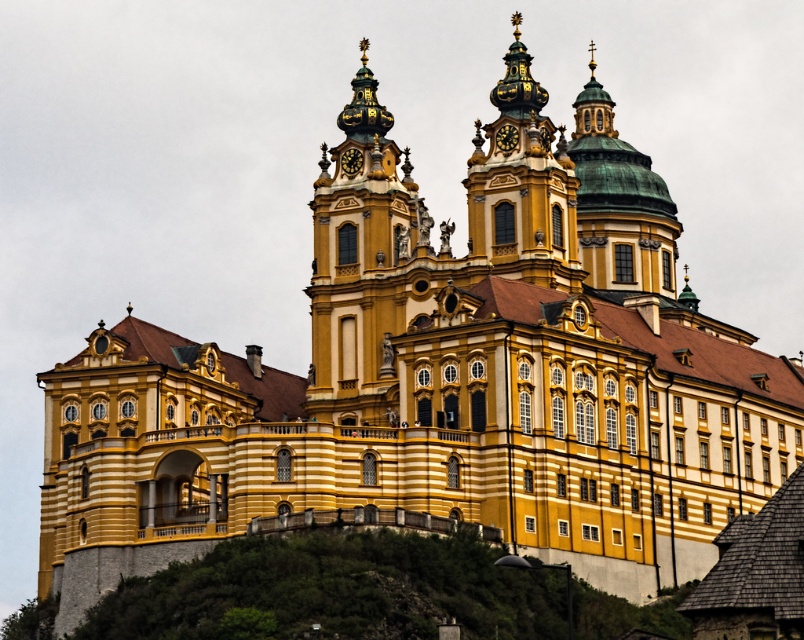
Question: Is golden stone tower at center positioned at the back of green copper dome at upper center?

Choices:
 (A) no
 (B) yes

Answer: (A)

Question: Observing the image, what is the correct spatial positioning of golden stone tower at center in reference to gold ornate clock tower at upper center?

Choices:
 (A) left
 (B) right

Answer: (A)

Question: Among these objects, which one is farthest from the camera?

Choices:
 (A) golden stone tower at center
 (B) gold ornate clock tower at upper center
 (C) green copper dome at upper center

Answer: (C)

Question: Based on their relative distances, which object is nearer to the golden stone tower at center?

Choices:
 (A) gold ornate clock tower at upper center
 (B) green copper dome at upper center

Answer: (A)

Question: Does golden stone tower at center appear over gold ornate clock tower at upper center?

Choices:
 (A) yes
 (B) no

Answer: (B)

Question: Among these objects, which one is farthest from the camera?

Choices:
 (A) gold ornate clock tower at upper center
 (B) golden stone tower at center
 (C) green copper dome at upper center

Answer: (C)